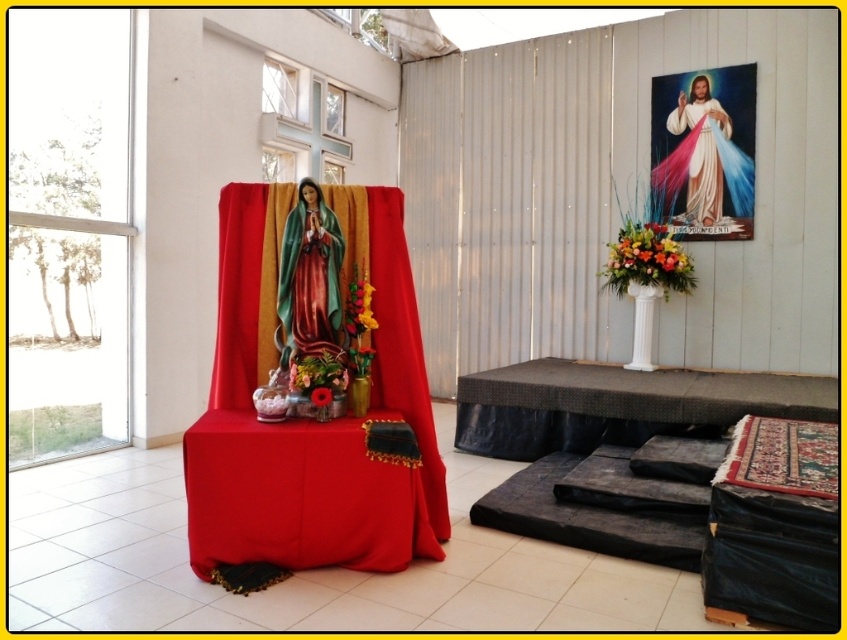
You are standing in the church and want to place a large candle on the black textured table at lower right. Considering the distance from where you are standing to the table, will you need to walk more than 12 feet to reach it?

The black textured table at lower right is 12.32 feet away from camera, so yes, you will need to walk more than 12 feet to reach it.

Based on the scene description, which object is shorter, the shiny green robe at center or the white silk robe at upper right?

The shiny green robe at center is shorter than the white silk robe at upper right.